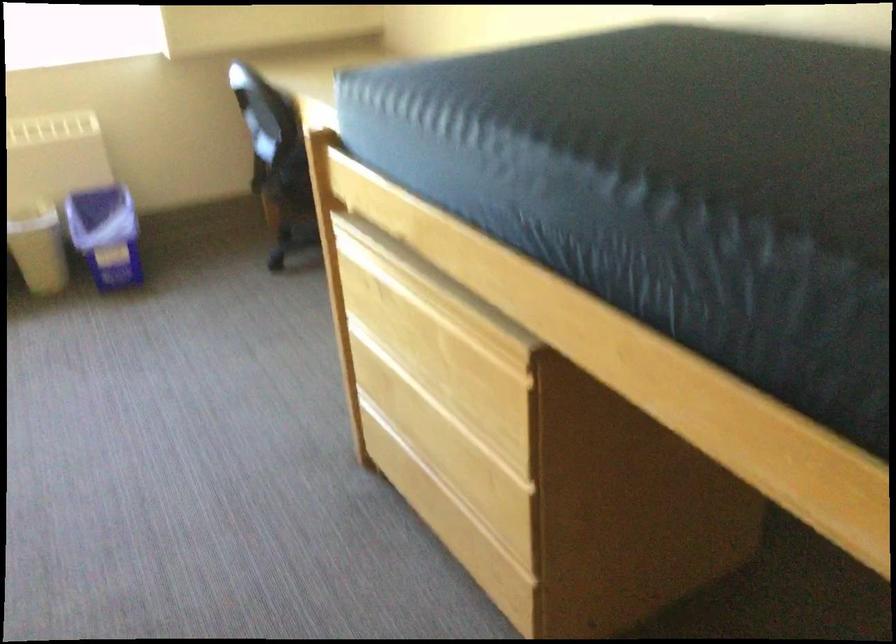
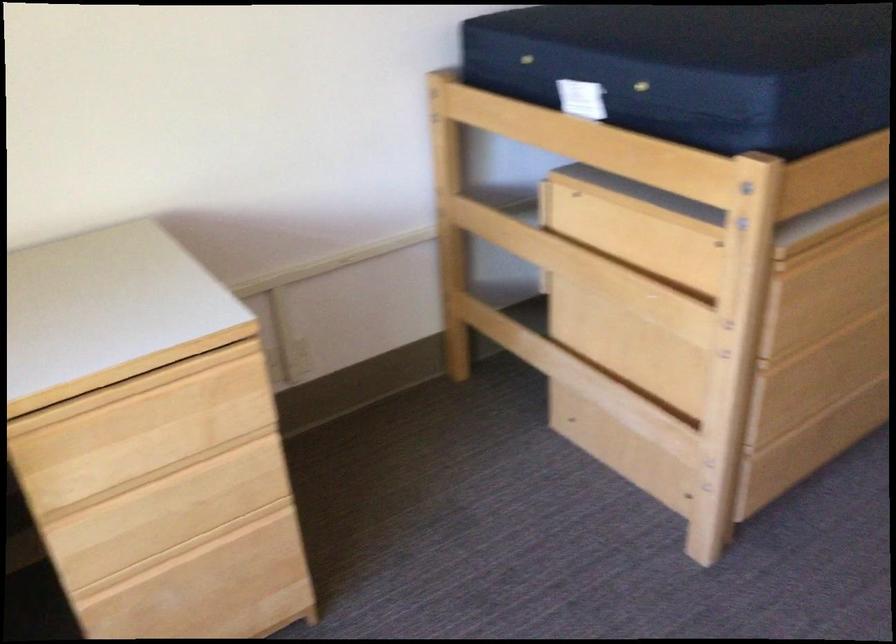
Find the pixel in the second image that matches [400,295] in the first image.

(828, 240)